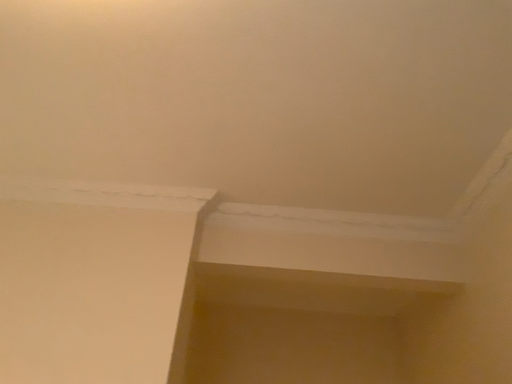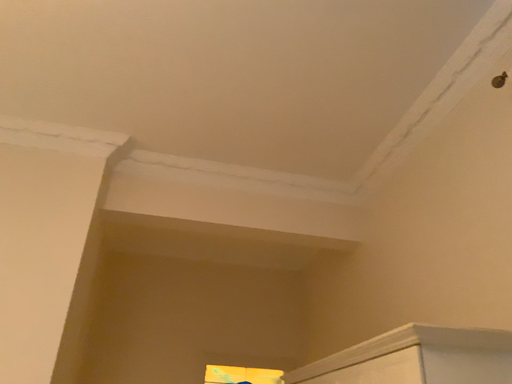
Question: How did the camera likely rotate when shooting the video?

Choices:
 (A) rotated downward
 (B) rotated upward

Answer: (A)